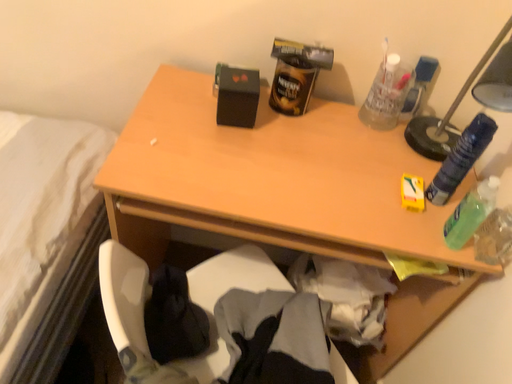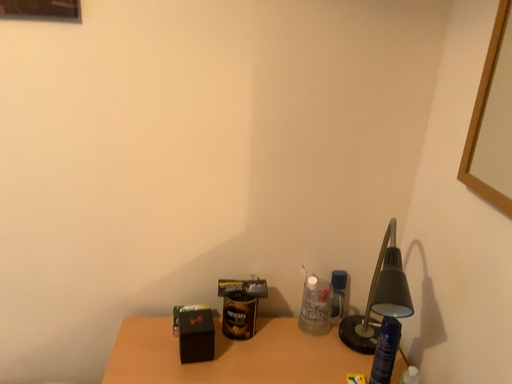
Question: How did the camera likely rotate when shooting the video?

Choices:
 (A) rotated upward
 (B) rotated downward

Answer: (A)